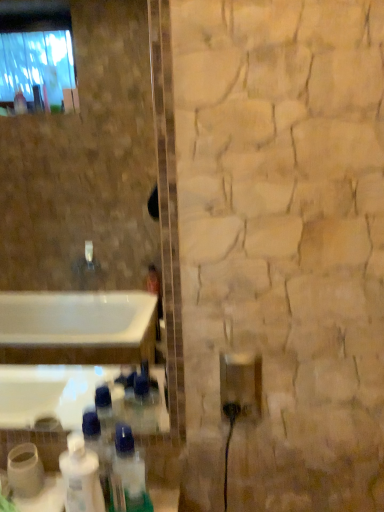
What is the approximate width of white glossy bottle at lower left, which appears as the second bottle when viewed from the right?

white glossy bottle at lower left, which appears as the second bottle when viewed from the right, is 5.84 centimeters in width.

The height and width of the screenshot is (512, 384). What do you see at coordinates (81, 477) in the screenshot?
I see `white glossy bottle at lower left` at bounding box center [81, 477].

The image size is (384, 512). What are the coordinates of `white glossy bottle at lower left, which is counted as the 1th bottle, starting from the left` in the screenshot? It's located at (98, 448).

Is clear plastic bottle at lower center, which ranks as the first bottle in right-to-left order, to the left of white glossy bottle at lower left from the viewer's perspective?

No, clear plastic bottle at lower center, which ranks as the first bottle in right-to-left order, is not to the left of white glossy bottle at lower left.

Can you tell me how much clear plastic bottle at lower center, the 2th bottle viewed from the left, and white glossy bottle at lower left differ in facing direction?

clear plastic bottle at lower center, the 2th bottle viewed from the left, and white glossy bottle at lower left are facing 1.37 degrees away from each other.

Find the location of `cleaning product lying below the clear plastic bottle at lower center, which ranks as the first bottle in right-to-left order (from the image's perspective)`. cleaning product lying below the clear plastic bottle at lower center, which ranks as the first bottle in right-to-left order (from the image's perspective) is located at coordinates (81, 477).

Is white glossy bottle at lower left positioned before white glossy bottle at lower left, which appears as the second bottle when viewed from the right?

Yes, white glossy bottle at lower left is closer to the camera.

Which is correct: white glossy bottle at lower left is inside white glossy bottle at lower left, which is counted as the 1th bottle, starting from the left, or outside of it?

white glossy bottle at lower left is outside white glossy bottle at lower left, which is counted as the 1th bottle, starting from the left.

Considering the sizes of objects white glossy bottle at lower left and white glossy bottle at lower left, which appears as the second bottle when viewed from the right, in the image provided, who is smaller, white glossy bottle at lower left or white glossy bottle at lower left, which appears as the second bottle when viewed from the right,?

Smaller between the two is white glossy bottle at lower left, which appears as the second bottle when viewed from the right.

Who is smaller, white glossy bottle at lower left, which is counted as the 1th bottle, starting from the left, or white glossy bottle at lower left?

white glossy bottle at lower left, which is counted as the 1th bottle, starting from the left.

Visually, is white glossy bottle at lower left, which is counted as the 1th bottle, starting from the left, positioned to the left or to the right of white glossy bottle at lower left?

Based on their positions, white glossy bottle at lower left, which is counted as the 1th bottle, starting from the left, is located to the left of white glossy bottle at lower left.

Is white glossy bottle at lower left, which appears as the second bottle when viewed from the right, far away from white glossy bottle at lower left?

No, white glossy bottle at lower left, which appears as the second bottle when viewed from the right, is not far away from white glossy bottle at lower left.

From the image's perspective, is white glossy bottle at lower left, which is counted as the 1th bottle, starting from the left, above or below white glossy bottle at lower left?

white glossy bottle at lower left, which is counted as the 1th bottle, starting from the left, is above white glossy bottle at lower left.

Consider the image. Between white glossy bottle at lower left, which is counted as the 1th bottle, starting from the left, and clear plastic bottle at lower center, the 2th bottle viewed from the left, which one is positioned behind?

Positioned behind is white glossy bottle at lower left, which is counted as the 1th bottle, starting from the left.

Is white glossy bottle at lower left, which is counted as the 1th bottle, starting from the left, to the right of clear plastic bottle at lower center, which ranks as the first bottle in right-to-left order, from the viewer's perspective?

In fact, white glossy bottle at lower left, which is counted as the 1th bottle, starting from the left, is to the left of clear plastic bottle at lower center, which ranks as the first bottle in right-to-left order.

Where is `bottle that appears on the right of white glossy bottle at lower left, which is counted as the 1th bottle, starting from the left`? The image size is (384, 512). bottle that appears on the right of white glossy bottle at lower left, which is counted as the 1th bottle, starting from the left is located at coordinates (128, 475).

From the image's perspective, between white glossy bottle at lower left, which appears as the second bottle when viewed from the right, and clear plastic bottle at lower center, the 2th bottle viewed from the left, which one is located above?

white glossy bottle at lower left, which appears as the second bottle when viewed from the right, from the image's perspective.

Looking at this image, does clear plastic bottle at lower center, the 2th bottle viewed from the left, have a greater width compared to white glossy bottle at lower left, which appears as the second bottle when viewed from the right?

Correct, the width of clear plastic bottle at lower center, the 2th bottle viewed from the left, exceeds that of white glossy bottle at lower left, which appears as the second bottle when viewed from the right.

Is clear plastic bottle at lower center, the 2th bottle viewed from the left, bigger than white glossy bottle at lower left, which is counted as the 1th bottle, starting from the left?

Indeed, clear plastic bottle at lower center, the 2th bottle viewed from the left, has a larger size compared to white glossy bottle at lower left, which is counted as the 1th bottle, starting from the left.

How different are the orientations of clear plastic bottle at lower center, which ranks as the first bottle in right-to-left order, and white glossy bottle at lower left, which is counted as the 1th bottle, starting from the left, in degrees?

clear plastic bottle at lower center, which ranks as the first bottle in right-to-left order, and white glossy bottle at lower left, which is counted as the 1th bottle, starting from the left, are facing 6.84e-05 degrees away from each other.

Is clear plastic bottle at lower center, the 2th bottle viewed from the left, not near white glossy bottle at lower left, which is counted as the 1th bottle, starting from the left?

No, there isn't a large distance between clear plastic bottle at lower center, the 2th bottle viewed from the left, and white glossy bottle at lower left, which is counted as the 1th bottle, starting from the left.

Do you think white glossy bottle at lower left is within clear plastic bottle at lower center, the 2th bottle viewed from the left, or outside of it?

white glossy bottle at lower left is spatially situated outside clear plastic bottle at lower center, the 2th bottle viewed from the left.

From the image's perspective, who appears lower, white glossy bottle at lower left or clear plastic bottle at lower center, which ranks as the first bottle in right-to-left order?

From the image's view, white glossy bottle at lower left is below.

Between white glossy bottle at lower left and clear plastic bottle at lower center, which ranks as the first bottle in right-to-left order, which one has smaller width?

white glossy bottle at lower left.

Can you tell me how much white glossy bottle at lower left and clear plastic bottle at lower center, which ranks as the first bottle in right-to-left order, differ in facing direction?

The angular difference between white glossy bottle at lower left and clear plastic bottle at lower center, which ranks as the first bottle in right-to-left order, is 1.37 degrees.

Find the location of `the 2nd bottle above the white glossy bottle at lower left (from a real-world perspective)`. the 2nd bottle above the white glossy bottle at lower left (from a real-world perspective) is located at coordinates (128, 475).

Locate an element on the screen. Image resolution: width=384 pixels, height=512 pixels. cleaning product that is under the white glossy bottle at lower left, which appears as the second bottle when viewed from the right (from a real-world perspective) is located at coordinates (81, 477).

When comparing their distances from white glossy bottle at lower left, which is counted as the 1th bottle, starting from the left, does clear plastic bottle at lower center, which ranks as the first bottle in right-to-left order, or white glossy bottle at lower left seem further?

Among the two, clear plastic bottle at lower center, which ranks as the first bottle in right-to-left order, is located further to white glossy bottle at lower left, which is counted as the 1th bottle, starting from the left.

From the image, which object appears to be farther from white glossy bottle at lower left, clear plastic bottle at lower center, which ranks as the first bottle in right-to-left order, or white glossy bottle at lower left, which appears as the second bottle when viewed from the right?

clear plastic bottle at lower center, which ranks as the first bottle in right-to-left order.

Based on their spatial positions, is white glossy bottle at lower left, which appears as the second bottle when viewed from the right, or white glossy bottle at lower left closer to clear plastic bottle at lower center, the 2th bottle viewed from the left?

white glossy bottle at lower left, which appears as the second bottle when viewed from the right.

Which object lies nearer to the anchor point white glossy bottle at lower left, which appears as the second bottle when viewed from the right, white glossy bottle at lower left or clear plastic bottle at lower center, which ranks as the first bottle in right-to-left order?

white glossy bottle at lower left.

Looking at the image, which one is located further to white glossy bottle at lower left, white glossy bottle at lower left, which appears as the second bottle when viewed from the right, or clear plastic bottle at lower center, the 2th bottle viewed from the left?

The object further to white glossy bottle at lower left is clear plastic bottle at lower center, the 2th bottle viewed from the left.

Based on their spatial positions, is white glossy bottle at lower left or white glossy bottle at lower left, which is counted as the 1th bottle, starting from the left, further from clear plastic bottle at lower center, which ranks as the first bottle in right-to-left order?

Answer: white glossy bottle at lower left is further to clear plastic bottle at lower center, which ranks as the first bottle in right-to-left order.

Image resolution: width=384 pixels, height=512 pixels. Identify the location of cleaning product between white glossy bottle at lower left, which appears as the second bottle when viewed from the right, and clear plastic bottle at lower center, which ranks as the first bottle in right-to-left order. (81, 477).